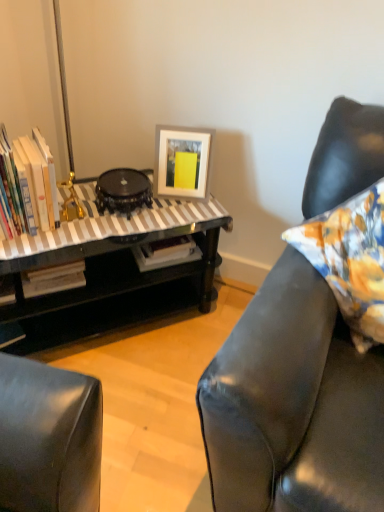
Question: In terms of size, does hardcover books at left appear bigger or smaller than floral fabric pillow at right?

Choices:
 (A) small
 (B) big

Answer: (A)

Question: Choose the correct answer: Is hardcover books at left inside floral fabric pillow at right or outside it?

Choices:
 (A) inside
 (B) outside

Answer: (B)

Question: Which object is the closest to the white matte picture frame at upper center?

Choices:
 (A) black glossy round table at center
 (B) hardcover books at left
 (C) floral fabric pillow at right
 (D) black glossy table at left

Answer: (A)

Question: Estimate the real-world distances between objects in this image. Which object is farther from the white matte picture frame at upper center?

Choices:
 (A) black glossy table at left
 (B) black glossy round table at center
 (C) hardcover books at left
 (D) floral fabric pillow at right

Answer: (D)